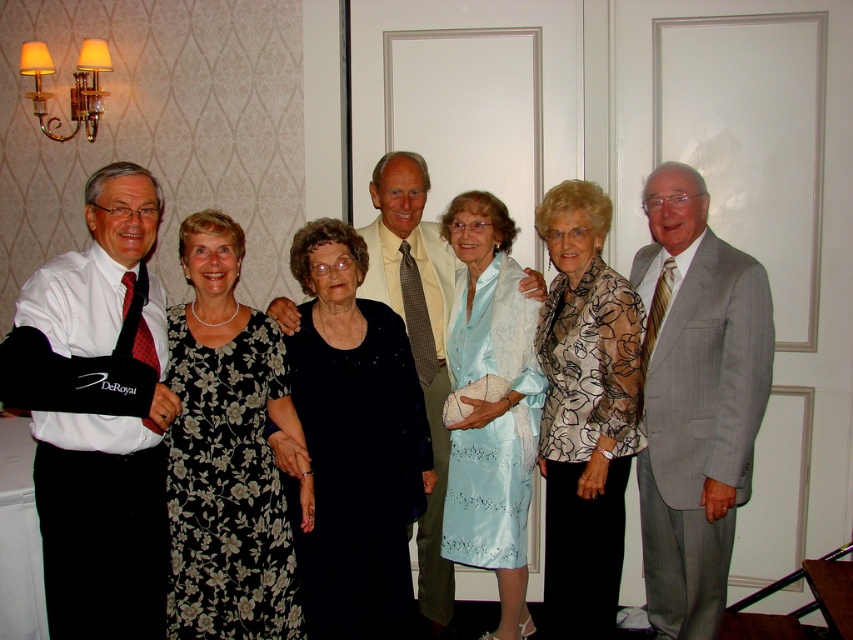
Who is higher up, white matte shirt at center or gray pinstripe suit at right?

white matte shirt at center is higher up.

Who is lower down, white matte shirt at center or gray pinstripe suit at right?

gray pinstripe suit at right

Is point (103, 563) closer to viewer compared to point (724, 392)?

Yes.

Locate an element on the screen. Image resolution: width=853 pixels, height=640 pixels. white matte shirt at center is located at coordinates 107,502.

Is point (717, 602) more distant than point (467, 310)?

No.

Based on the photo, does gray pinstripe suit at right appear on the left side of satin dress at center?

In fact, gray pinstripe suit at right is to the right of satin dress at center.

Locate an element on the screen. This screenshot has width=853, height=640. gray pinstripe suit at right is located at coordinates (695, 401).

Measure the distance from gray pinstripe suit at right to black floral dress at center.

gray pinstripe suit at right is 3.79 feet away from black floral dress at center.

This screenshot has height=640, width=853. What do you see at coordinates (695, 401) in the screenshot?
I see `gray pinstripe suit at right` at bounding box center [695, 401].

At what (x,y) coordinates should I click in order to perform the action: click on gray pinstripe suit at right. Please return your answer as a coordinate pair (x, y). Image resolution: width=853 pixels, height=640 pixels. Looking at the image, I should click on (695, 401).